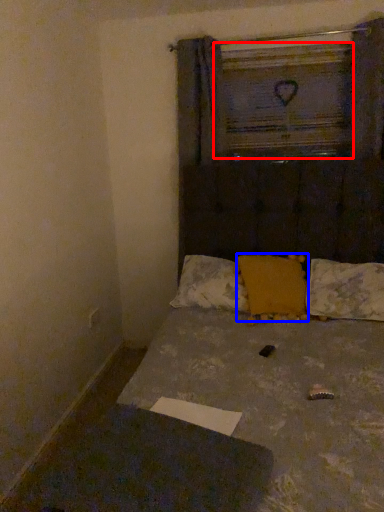
Question: Which object is further to the camera taking this photo, window frame (highlighted by a red box) or pillow (highlighted by a blue box)?

Choices:
 (A) window frame
 (B) pillow

Answer: (A)